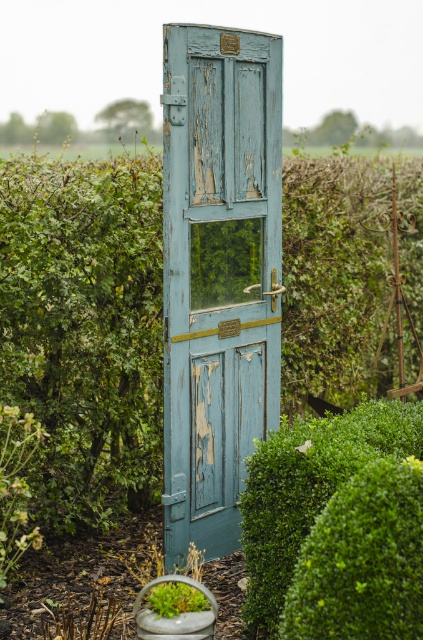
Question: Which point is farther to the camera?

Choices:
 (A) green leafy bush at center
 (B) green leafy bush at right

Answer: (A)

Question: Can you confirm if blue peeling paint door at center is bigger than green leafy bush at center?

Choices:
 (A) yes
 (B) no

Answer: (B)

Question: Can you confirm if green leafy bush at center is positioned to the left of green leafy bush at right?

Choices:
 (A) yes
 (B) no

Answer: (A)

Question: Among these objects, which one is farthest from the camera?

Choices:
 (A) green leafy bush at center
 (B) blue peeling paint door at center
 (C) green leafy bush at right

Answer: (A)

Question: Which object is closer to the camera taking this photo?

Choices:
 (A) green leafy bush at center
 (B) blue peeling paint door at center

Answer: (B)

Question: Is blue peeling paint door at center to the right of green leafy bush at center from the viewer's perspective?

Choices:
 (A) yes
 (B) no

Answer: (A)